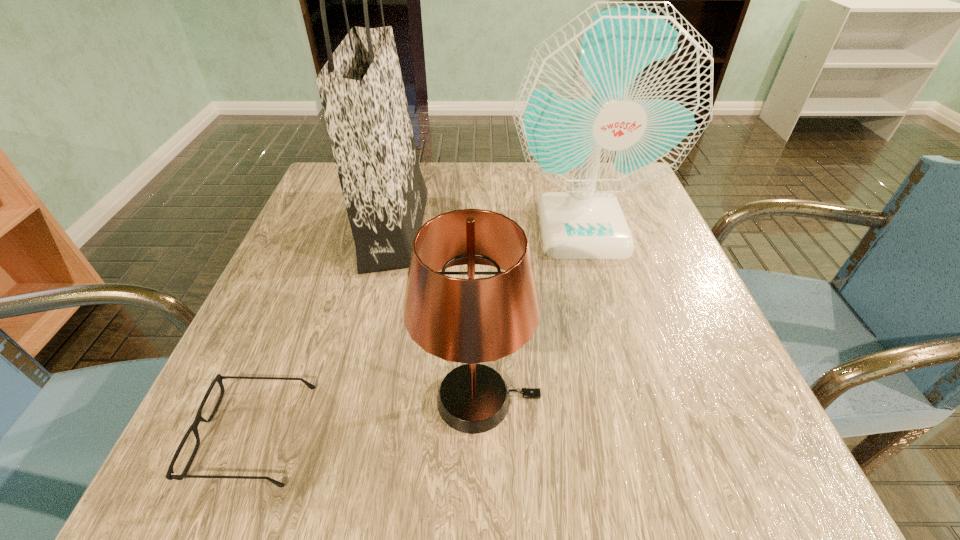
Where is `the third object from right to left`? The image size is (960, 540). the third object from right to left is located at coordinates (361, 89).

This screenshot has width=960, height=540. In order to click on fan in this screenshot , I will do `click(613, 101)`.

Identify the location of the third tallest object. The image size is (960, 540). (470, 321).

I want to click on spectacles, so click(170, 475).

This screenshot has width=960, height=540. What are the coordinates of `the leftmost object` in the screenshot? It's located at pyautogui.click(x=170, y=475).

Where is `free region located 0.070m on the front of the second object from left to right with the design`? Image resolution: width=960 pixels, height=540 pixels. free region located 0.070m on the front of the second object from left to right with the design is located at coordinates (454, 229).

Find the location of a particular element. The width and height of the screenshot is (960, 540). free region located 0.280m in front of the fan to face the airflow is located at coordinates (624, 379).

Identify the location of vacant area located 0.260m on the front-facing side of the lampshade. (716, 400).

Identify the location of shopping bag situated at the far edge. This screenshot has height=540, width=960. (361, 89).

Find the location of a particular element. Image resolution: width=960 pixels, height=540 pixels. fan that is at the far edge is located at coordinates (613, 101).